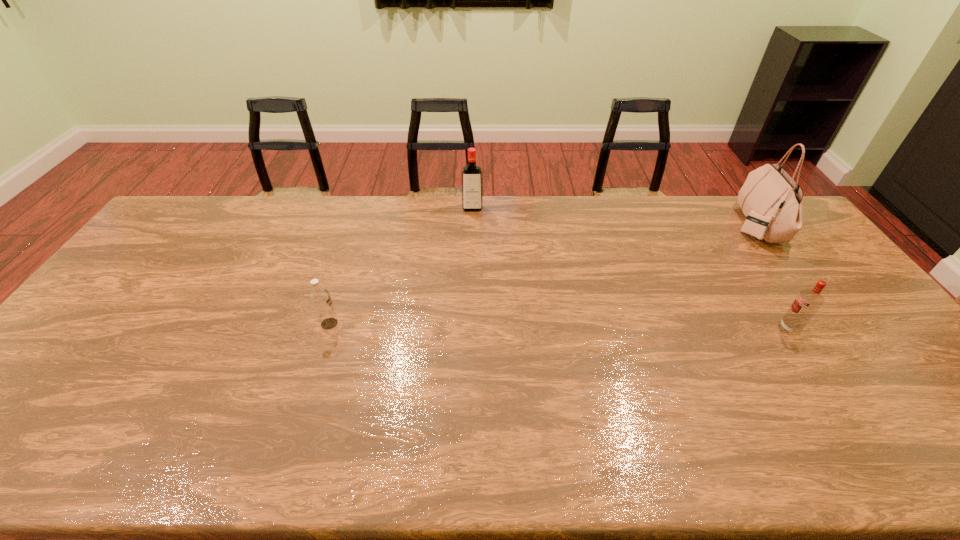
Identify the location of the tallest object. The width and height of the screenshot is (960, 540). (772, 201).

Where is `the rightmost object`? Image resolution: width=960 pixels, height=540 pixels. the rightmost object is located at coordinates (772, 201).

This screenshot has width=960, height=540. Find the location of `the third object from right to left`. the third object from right to left is located at coordinates (471, 174).

This screenshot has width=960, height=540. In order to click on the farthest vodka in this screenshot , I will do `click(471, 174)`.

Locate an element on the screen. Image resolution: width=960 pixels, height=540 pixels. the second object from right to left is located at coordinates (807, 303).

This screenshot has width=960, height=540. In order to click on the leftmost vodka in this screenshot , I will do `click(320, 298)`.

I want to click on vacant space located on the side of the tallest object with the attached pouch, so click(x=655, y=224).

At what (x,y) coordinates should I click in order to perform the action: click on free space located 0.060m on the side of the tallest object with the attached pouch. Please return your answer as a coordinate pair (x, y). Image resolution: width=960 pixels, height=540 pixels. Looking at the image, I should click on (718, 224).

This screenshot has height=540, width=960. I want to click on free region located on the side of the tallest object with the attached pouch, so click(x=630, y=224).

Image resolution: width=960 pixels, height=540 pixels. Find the location of `vacant region located 0.060m on the front and back of the farthest vodka`. vacant region located 0.060m on the front and back of the farthest vodka is located at coordinates (472, 222).